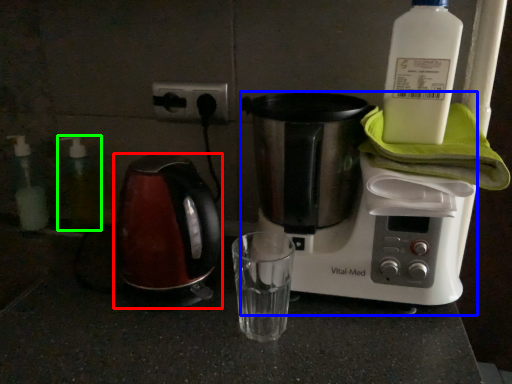
Question: Considering the real-world distances, which object is closest to kettle (highlighted by a red box)? coffee maker (highlighted by a blue box) or bottle (highlighted by a green box).

Choices:
 (A) coffee maker
 (B) bottle

Answer: (A)